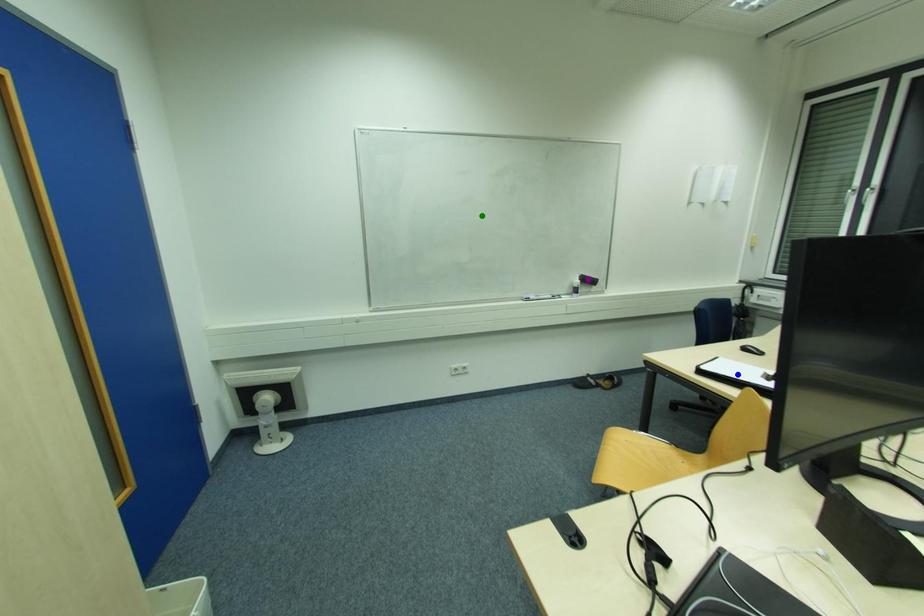
Order these from nearest to farthest:
A) purple point
B) green point
C) blue point

blue point, green point, purple point